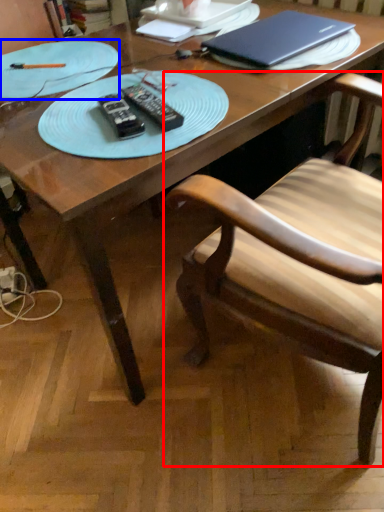
Question: Among these objects, which one is farthest to the camera, chair (highlighted by a red box) or plate (highlighted by a blue box)?

Choices:
 (A) chair
 (B) plate

Answer: (B)